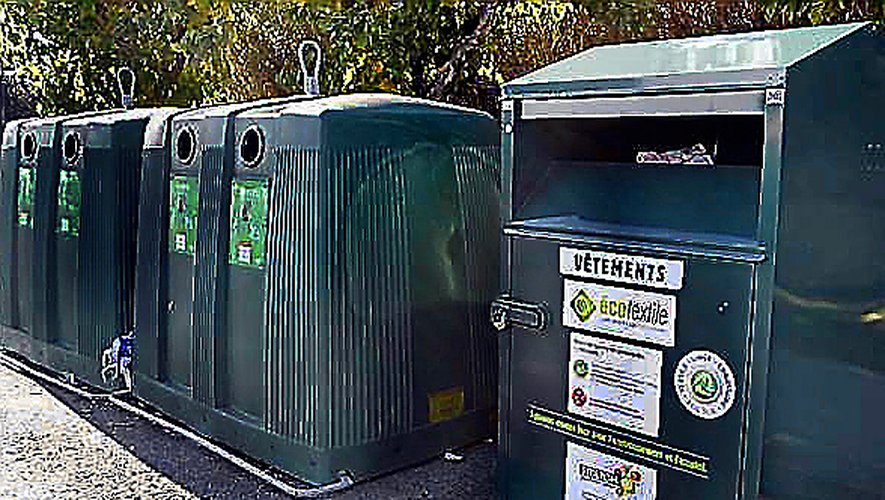
This screenshot has height=500, width=885. Identify the location of signs with white background on recycling bin. (670, 273), (621, 298), (612, 357), (590, 475), (709, 366).